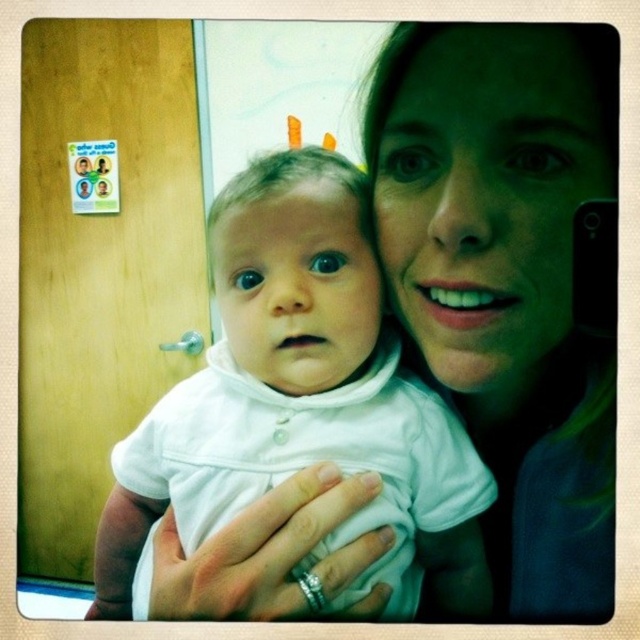
You are a photographer adjusting the lighting for a photo shoot. You need to ensure that the matte white shirt at center and the white matte baby at center are evenly lit. Given their current distance apart, what should you consider about their positions to achieve balanced lighting?

The matte white shirt at center is 11.40 centimeters from white matte baby at center. To achieve balanced lighting, ensure both are within the same lighting range, considering their proximity so light distribution is even between them.

You are a photographer standing 18 inches away from the camera. You want to take a photo of the matte white shirt at center. Can you reach it without moving closer?

The matte white shirt at center is 15.66 inches away from camera. Since you are standing 18 inches away from the camera, you are farther than the shirt. To take the photo, you need to move closer to the camera so that you are within 15.66 inches.

You are a photographer setting up for a family photo. You see the matte white shirt at center and the white matte baby at center in the frame. Which object is higher up in the image?

The matte white shirt at center is much taller than the white matte baby at center, so the matte white shirt at center is higher up in the image.